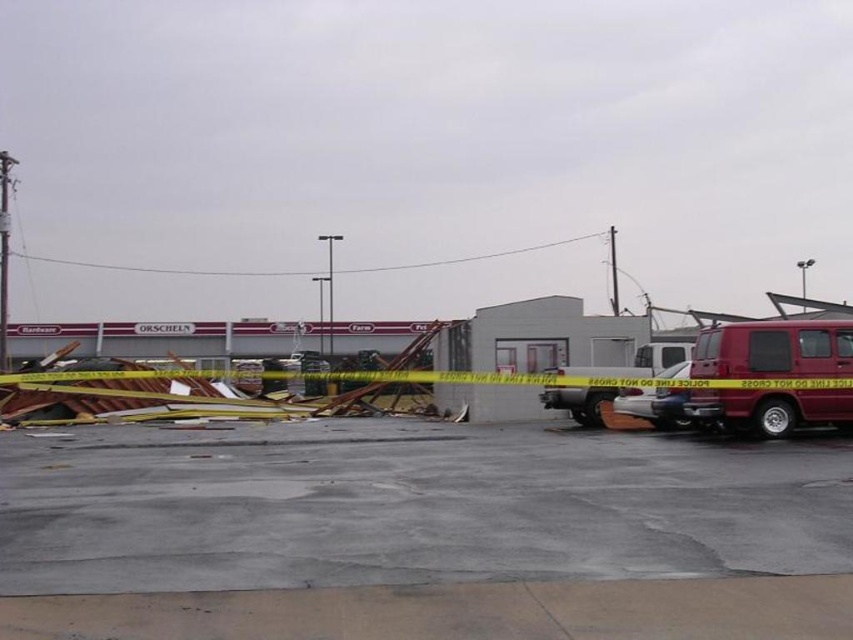
Can you confirm if matte red van at right is positioned above metallic silver van at center?

Yes, matte red van at right is above metallic silver van at center.

Who is more distant from viewer, (744, 420) or (643, 408)?

Positioned behind is point (643, 408).

Where is `matte red van at right`? This screenshot has height=640, width=853. matte red van at right is located at coordinates (773, 349).

You are a GUI agent. You are given a task and a screenshot of the screen. Output one action in this format:
    pyautogui.click(x=<x>, y=<y>)
    Task: Click on the matte red van at right
    
    Given the screenshot: What is the action you would take?
    pyautogui.click(x=773, y=349)

Describe the element at coordinates (421, 534) in the screenshot. Image resolution: width=853 pixels, height=640 pixels. I see `gray concrete pavement at center` at that location.

Does point (747, 522) come farther from viewer compared to point (805, 397)?

No, it is in front of (805, 397).

This screenshot has height=640, width=853. What are the coordinates of `gray concrete pavement at center` in the screenshot? It's located at (421, 534).

Does gray concrete pavement at center lie behind metallic silver van at center?

No, it is in front of metallic silver van at center.

At what (x,y) coordinates should I click in order to perform the action: click on gray concrete pavement at center. Please return your answer as a coordinate pair (x, y). The height and width of the screenshot is (640, 853). Looking at the image, I should click on (421, 534).

Locate an element on the screen. The width and height of the screenshot is (853, 640). gray concrete pavement at center is located at coordinates (421, 534).